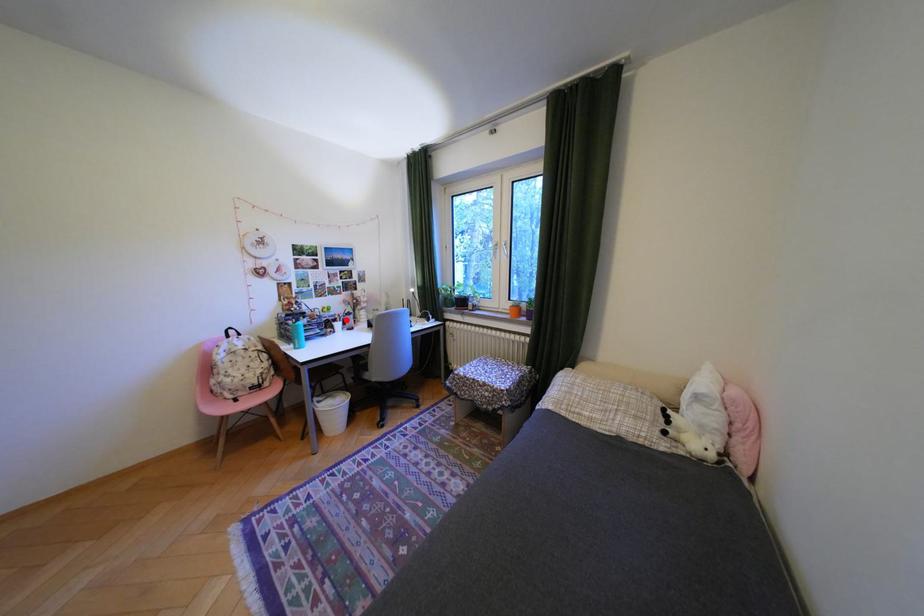
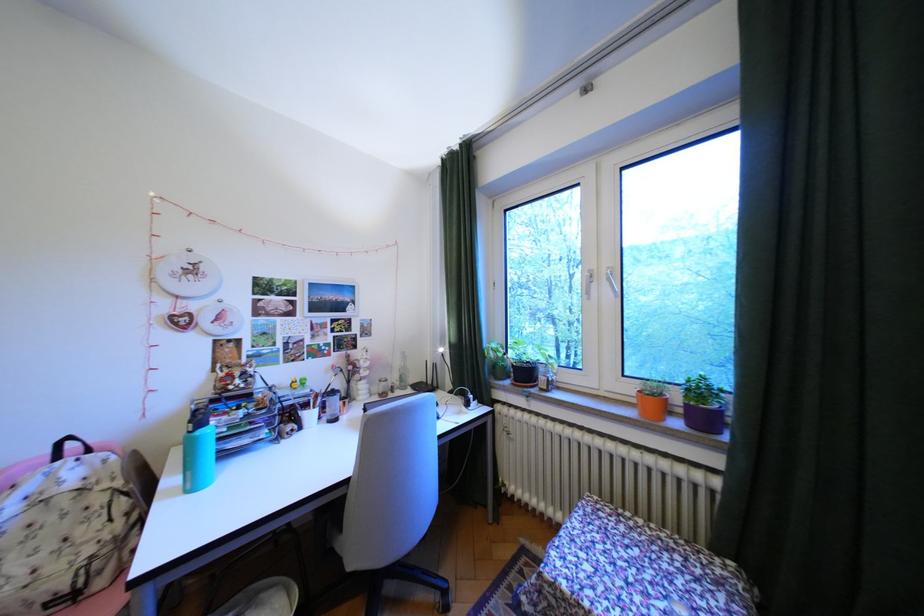
Question: I am providing you with two images of the same scene from different viewpoints. A red point is shown in image1. For the corresponding object point in image2, is it positioned nearer or farther from the camera?

Choices:
 (A) Nearer
 (B) Farther

Answer: (B)